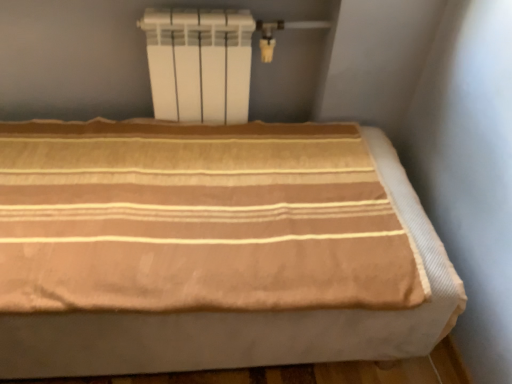
The height and width of the screenshot is (384, 512). What are the coordinates of `vacant area on top of white matte radiator at upper center (from a real-world perspective)` in the screenshot? It's located at (223, 9).